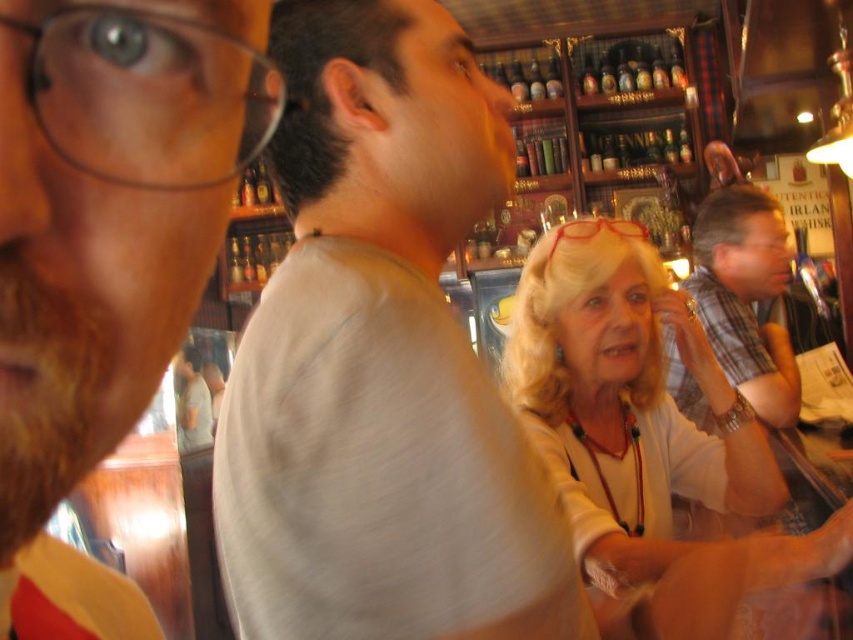
Which of these two, gray cotton shirt at center or light beige blouse at center, stands taller?

With more height is gray cotton shirt at center.

Can you confirm if gray cotton shirt at center is taller than light beige blouse at center?

Indeed, gray cotton shirt at center has a greater height compared to light beige blouse at center.

Locate an element on the screen. This screenshot has width=853, height=640. gray cotton shirt at center is located at coordinates (381, 362).

Which is behind, point (160, 172) or point (686, 406)?

The point (686, 406) is behind.

Does white matte shirt at center have a lesser height compared to plaid shirt at right?

Indeed, white matte shirt at center has a lesser height compared to plaid shirt at right.

Image resolution: width=853 pixels, height=640 pixels. I want to click on white matte shirt at center, so click(105, 256).

Image resolution: width=853 pixels, height=640 pixels. I want to click on white matte shirt at center, so click(105, 256).

Which is above, gray cotton shirt at center or plaid shirt at right?

gray cotton shirt at center is above.

Between gray cotton shirt at center and plaid shirt at right, which one has more height?

Standing taller between the two is gray cotton shirt at center.

What do you see at coordinates (381, 362) in the screenshot?
I see `gray cotton shirt at center` at bounding box center [381, 362].

This screenshot has height=640, width=853. Find the location of `gray cotton shirt at center`. gray cotton shirt at center is located at coordinates [x=381, y=362].